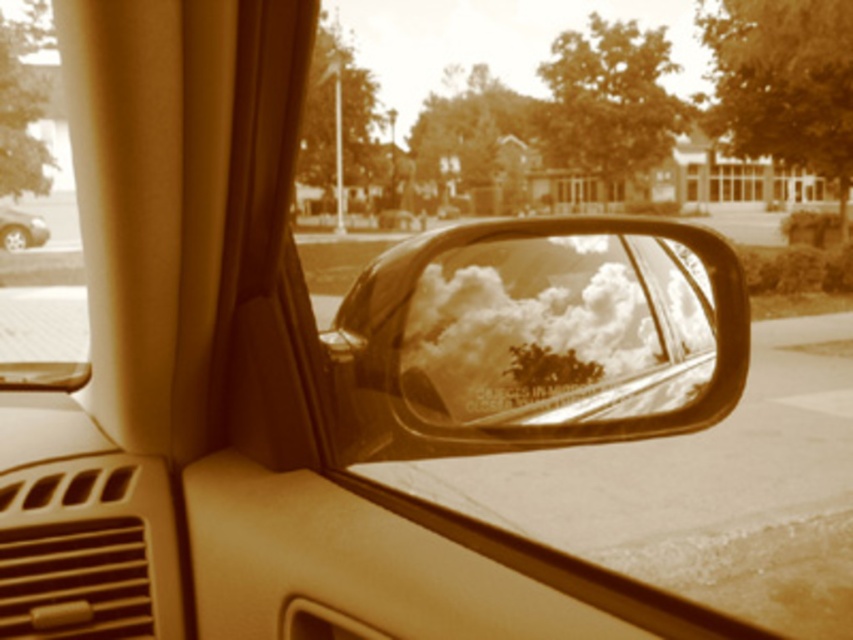
Describe the element at coordinates (88, 550) in the screenshot. I see `matte plastic dashboard at lower left` at that location.

Is point (151, 620) behind point (41, 369)?

No, (151, 620) is closer to viewer.

Locate an element on the screen. Image resolution: width=853 pixels, height=640 pixels. matte plastic dashboard at lower left is located at coordinates pos(88,550).

Does transparent glass car window at upper left have a lesser width compared to metallic silver car at left?

No, transparent glass car window at upper left is not thinner than metallic silver car at left.

Can you confirm if transparent glass car window at upper left is smaller than metallic silver car at left?

Incorrect, transparent glass car window at upper left is not smaller in size than metallic silver car at left.

The height and width of the screenshot is (640, 853). Find the location of `transparent glass car window at upper left`. transparent glass car window at upper left is located at coordinates pos(22,100).

Locate an element on the screen. Image resolution: width=853 pixels, height=640 pixels. transparent glass car window at upper left is located at coordinates (22, 100).

Is shiny reflective mirror at center to the left of transparent glass car window at upper left from the viewer's perspective?

In fact, shiny reflective mirror at center is to the right of transparent glass car window at upper left.

At what (x,y) coordinates should I click in order to perform the action: click on shiny reflective mirror at center. Please return your answer as a coordinate pair (x, y). This screenshot has height=640, width=853. Looking at the image, I should click on (538, 337).